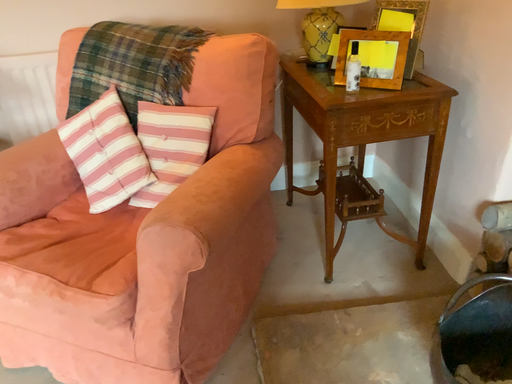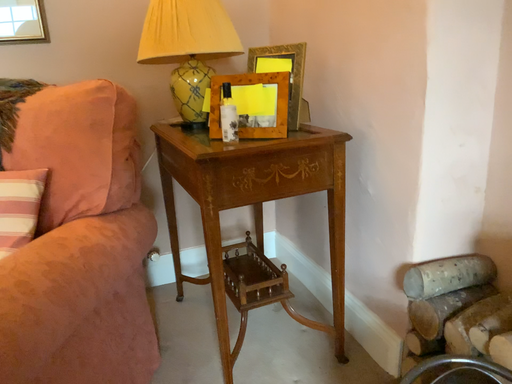
Question: Which way did the camera rotate in the video?

Choices:
 (A) rotated downward
 (B) rotated upward

Answer: (B)